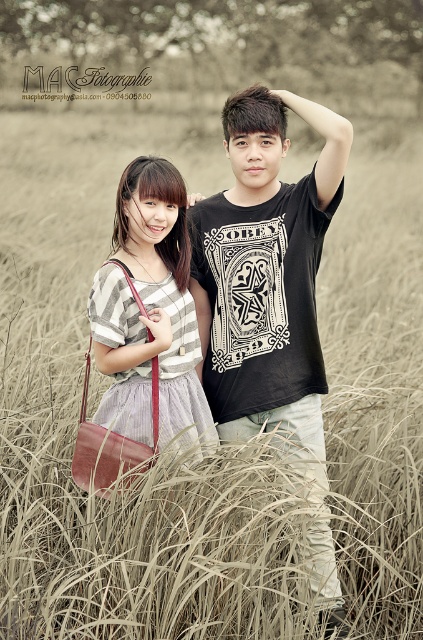
How much distance is there between black cotton t-shirt at center and matte striped shirt at center?

black cotton t-shirt at center is 15.82 inches away from matte striped shirt at center.

Does black cotton t-shirt at center have a lesser width compared to matte striped shirt at center?

Incorrect, black cotton t-shirt at center's width is not less than matte striped shirt at center's.

Who is more forward, (308,204) or (140,381)?

Positioned in front is point (140,381).

Where is `black cotton t-shirt at center`? The height and width of the screenshot is (640, 423). black cotton t-shirt at center is located at coordinates (271, 296).